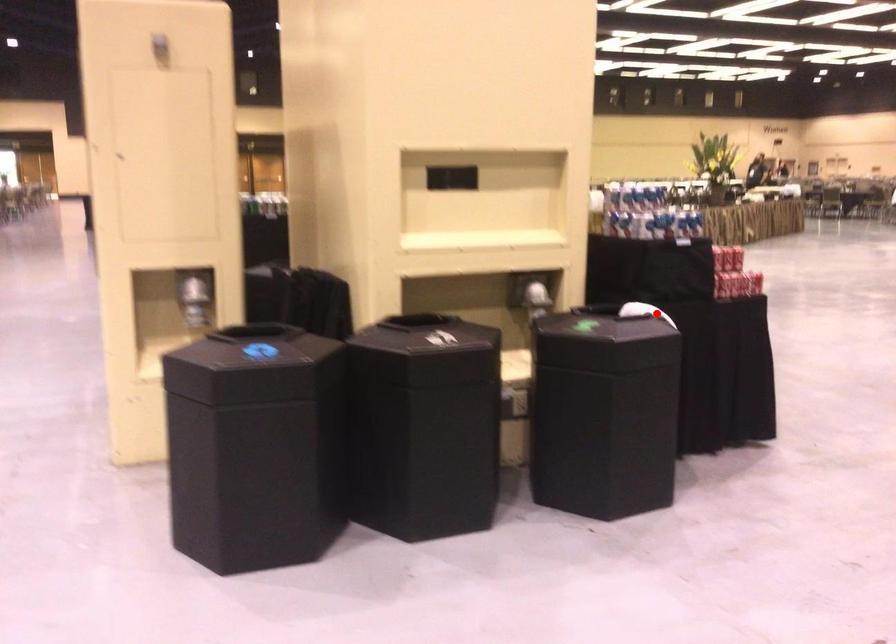
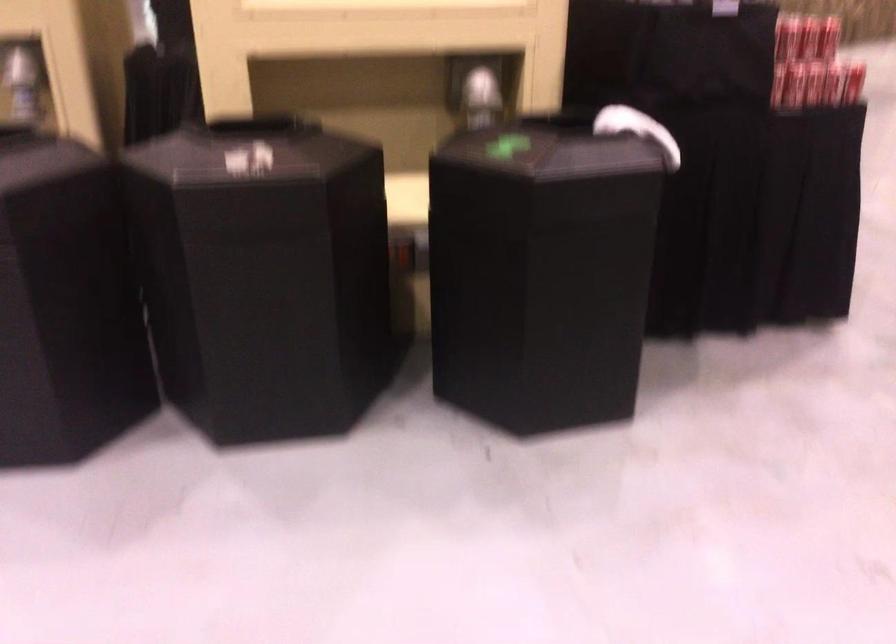
In the second image, find the point that corresponds to the highlighted location in the first image.

(636, 129)